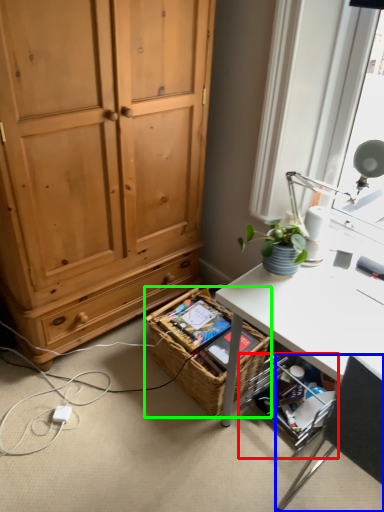
Question: Considering the real-world distances, which object is closest to shelf (highlighted by a red box)? chair (highlighted by a blue box) or picnic basket (highlighted by a green box).

Choices:
 (A) chair
 (B) picnic basket

Answer: (B)